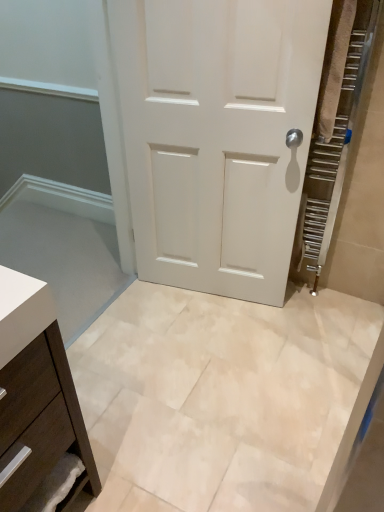
What is the approximate height of beige marble tile at center?

The height of beige marble tile at center is 1.84 inches.

Locate an element on the screen. The height and width of the screenshot is (512, 384). white matte door at center is located at coordinates (217, 136).

The image size is (384, 512). Identify the location of beige marble tile at center. (221, 397).

Is point (269, 256) farther from camera compared to point (152, 452)?

Yes, it is.

Does white matte door at center lie behind beige marble tile at center?

Yes, white matte door at center is behind beige marble tile at center.

How many degrees apart are the facing directions of white matte door at center and beige marble tile at center?

The angular difference between white matte door at center and beige marble tile at center is 101 degrees.

Based on the photo, is white matte door at center turned away from beige marble tile at center?

That's not correct — white matte door at center is not looking away from beige marble tile at center.

Is point (214, 483) closer to camera compared to point (49, 425)?

No.

Could you tell me if beige marble tile at center is turned towards matte brown drawer at lower left?

No, beige marble tile at center is not turned towards matte brown drawer at lower left.

How many degrees apart are the facing directions of beige marble tile at center and matte brown drawer at lower left?

The facing directions of beige marble tile at center and matte brown drawer at lower left are 180 degrees apart.

In the scene shown: Is matte brown drawer at lower left inside beige marble tile at center?

No, matte brown drawer at lower left is not surrounded by beige marble tile at center.

Is matte brown drawer at lower left turned away from beige marble tile at center?

No, matte brown drawer at lower left is not facing away from beige marble tile at center.

Looking at their sizes, would you say matte brown drawer at lower left is wider or thinner than beige marble tile at center?

In the image, matte brown drawer at lower left appears to be more narrow than beige marble tile at center.

Considering the positions of point (32, 432) and point (358, 407), is point (32, 432) closer or farther from the camera than point (358, 407)?

Point (32, 432) is positioned farther from the camera compared to point (358, 407).

What's the angular difference between matte brown drawer at lower left and beige marble tile at center's facing directions?

The facing directions of matte brown drawer at lower left and beige marble tile at center are 180 degrees apart.

Could you tell me if beige marble tile at center is turned towards white matte door at center?

No, beige marble tile at center does not turn towards white matte door at center.

Is beige marble tile at center completely or partially outside of white matte door at center?

beige marble tile at center lies outside white matte door at center's area.

Considering the positions of point (196, 454) and point (234, 248), is point (196, 454) closer or farther from the camera than point (234, 248)?

Point (196, 454) is closer to the camera than point (234, 248).

Considering the relative sizes of beige marble tile at center and white matte door at center in the image provided, is beige marble tile at center shorter than white matte door at center?

Indeed, beige marble tile at center has a lesser height compared to white matte door at center.

Considering the positions of point (53, 400) and point (156, 7), is point (53, 400) closer or farther from the camera than point (156, 7)?

Point (53, 400) is positioned closer to the camera compared to point (156, 7).

Find the location of a particular element. The height and width of the screenshot is (512, 384). drawer below the white matte door at center (from a real-world perspective) is located at coordinates (37, 453).

Looking at this image, between matte brown drawer at lower left and white matte door at center, which one has more height?

white matte door at center is taller.

Is matte brown drawer at lower left looking in the opposite direction of white matte door at center?

matte brown drawer at lower left does not have its back to white matte door at center.

Consider the image. Is white matte door at center shorter than matte brown drawer at lower left?

No.

Does white matte door at center come in front of matte brown drawer at lower left?

No, white matte door at center is behind matte brown drawer at lower left.

Can you confirm if white matte door at center is positioned to the right of matte brown drawer at lower left?

Correct, you'll find white matte door at center to the right of matte brown drawer at lower left.

Is white matte door at center spatially inside matte brown drawer at lower left, or outside of it?

white matte door at center cannot be found inside matte brown drawer at lower left.

Where is `ceramic tile in front of the white matte door at center`? The image size is (384, 512). ceramic tile in front of the white matte door at center is located at coordinates (221, 397).

Locate an element on the screen. ceramic tile on the right of matte brown drawer at lower left is located at coordinates (221, 397).

Looking at the image, which one is located closer to matte brown drawer at lower left, white matte door at center or beige marble tile at center?

Among the two, beige marble tile at center is located nearer to matte brown drawer at lower left.

Considering their positions, is matte brown drawer at lower left positioned further to beige marble tile at center than white matte door at center?

matte brown drawer at lower left lies further to beige marble tile at center than the other object.

When comparing their distances from white matte door at center, does matte brown drawer at lower left or beige marble tile at center seem further?

matte brown drawer at lower left.

From the image, which object appears to be nearer to white matte door at center, beige marble tile at center or matte brown drawer at lower left?

beige marble tile at center lies closer to white matte door at center than the other object.

Estimate the real-world distances between objects in this image. Which object is closer to matte brown drawer at lower left, beige marble tile at center or white matte door at center?

Among the two, beige marble tile at center is located nearer to matte brown drawer at lower left.

Which object lies nearer to the anchor point beige marble tile at center, white matte door at center or matte brown drawer at lower left?

white matte door at center.

The image size is (384, 512). Find the location of `ceramic tile that lies between white matte door at center and matte brown drawer at lower left from top to bottom`. ceramic tile that lies between white matte door at center and matte brown drawer at lower left from top to bottom is located at coordinates (221, 397).